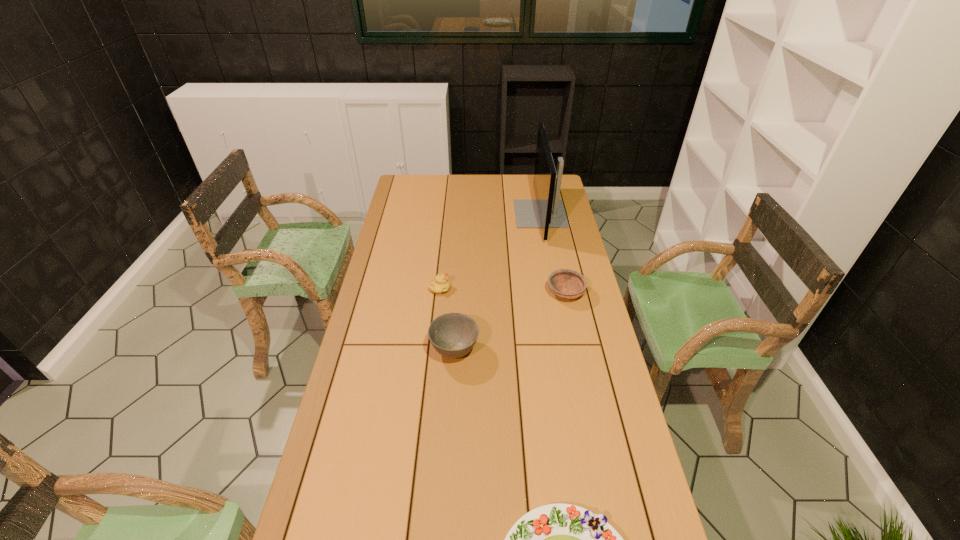
Find the location of a particular element. computer monitor is located at coordinates (547, 211).

At what (x,y) coordinates should I click in order to perform the action: click on the tallest object. Please return your answer as a coordinate pair (x, y). Image resolution: width=960 pixels, height=540 pixels. Looking at the image, I should click on (547, 211).

Where is `the left bowl`? the left bowl is located at coordinates 453,335.

I want to click on the taller bowl, so click(x=453, y=335).

What are the coordinates of `duckling` in the screenshot? It's located at (440, 284).

Identify the location of the farther bowl. (568, 284).

The height and width of the screenshot is (540, 960). Find the location of `the right bowl`. the right bowl is located at coordinates (568, 284).

Image resolution: width=960 pixels, height=540 pixels. In order to click on free space located on the screen of the tallest object in this screenshot , I will do `click(466, 214)`.

Identify the location of vacant space located 0.070m on the screen of the tallest object. Image resolution: width=960 pixels, height=540 pixels. (500, 214).

You are a GUI agent. You are given a task and a screenshot of the screen. Output one action in this format:
    pyautogui.click(x=<x>, y=<y>)
    Task: Click on the free space located 0.100m on the screen of the tallest object
    The width and height of the screenshot is (960, 540).
    Given the screenshot: What is the action you would take?
    pyautogui.click(x=494, y=214)